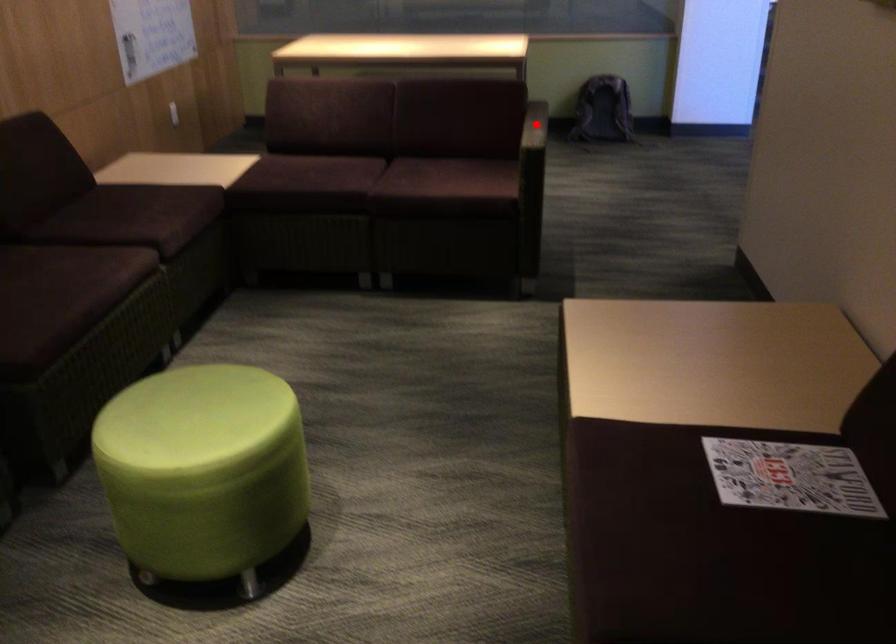
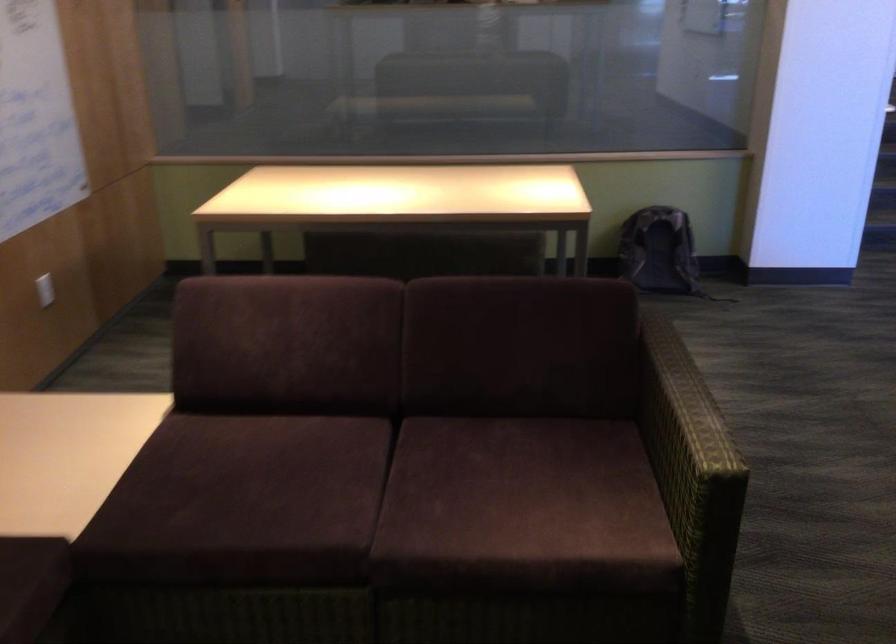
Question: I am providing you with two images of the same scene from different viewpoints. In image1, a red point is highlighted. Considering the same 3D point in image2, which of the following is correct?

Choices:
 (A) It is closer
 (B) It is farther

Answer: (A)